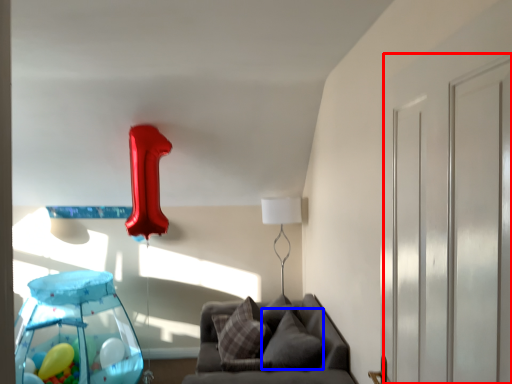
Question: Which object appears farthest to the camera in this image, glass door (highlighted by a red box) or pillow (highlighted by a blue box)?

Choices:
 (A) glass door
 (B) pillow

Answer: (B)